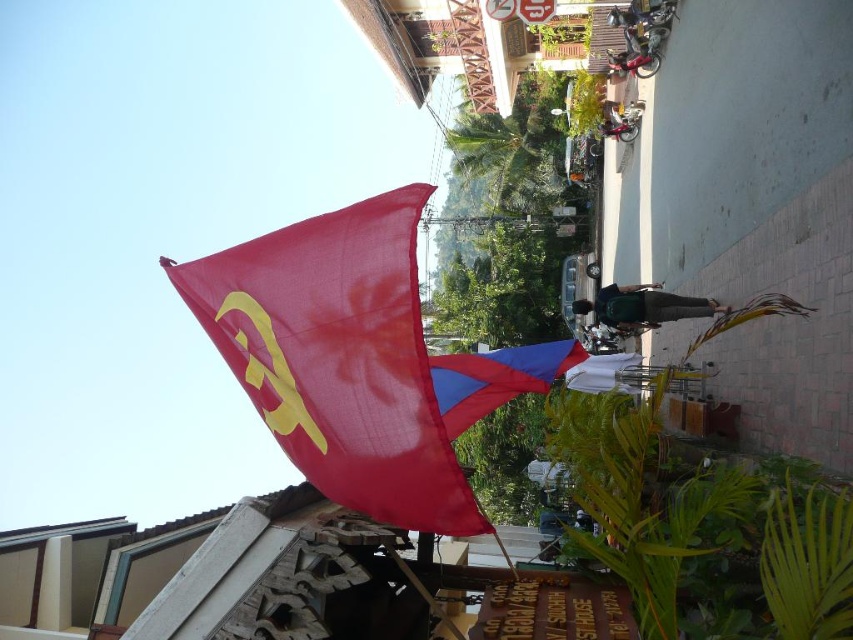
Measure the distance between matte red flag at upper left and camera.

matte red flag at upper left is 2.57 meters from camera.

Is matte red flag at upper left positioned before blue fabric kite at center?

Yes, matte red flag at upper left is closer to the viewer.

Image resolution: width=853 pixels, height=640 pixels. What do you see at coordinates (339, 356) in the screenshot?
I see `matte red flag at upper left` at bounding box center [339, 356].

The image size is (853, 640). Identify the location of matte red flag at upper left. (339, 356).